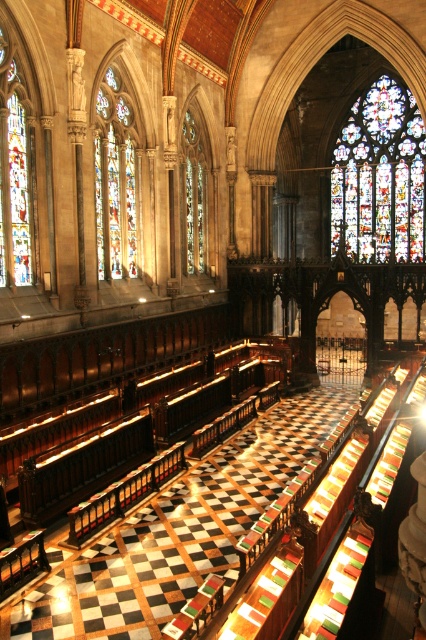
Does point (396, 106) come behind point (118, 244)?

Yes, point (396, 106) is farther from viewer.

Can you confirm if stained glass at upper center is bigger than stained glass window at center?

Correct, stained glass at upper center is larger in size than stained glass window at center.

Does point (354, 177) lie behind point (112, 92)?

Yes, it is.

At what (x,y) coordinates should I click in order to perform the action: click on stained glass at upper center. Please return your answer as a coordinate pair (x, y). This screenshot has height=640, width=426. Looking at the image, I should click on (379, 177).

Who is lower down, stained glass at upper center or stained glass window at left?

stained glass window at left is lower down.

Is point (423, 243) closer to viewer compared to point (34, 225)?

That is False.

The image size is (426, 640). I want to click on stained glass at upper center, so click(379, 177).

Is stained glass window at center shorter than stained glass window at left?

In fact, stained glass window at center may be taller than stained glass window at left.

Is stained glass window at center positioned at the back of stained glass window at left?

Yes, stained glass window at center is behind stained glass window at left.

Image resolution: width=426 pixels, height=640 pixels. What do you see at coordinates (117, 180) in the screenshot? I see `stained glass window at center` at bounding box center [117, 180].

Identify the location of stained glass window at center. (117, 180).